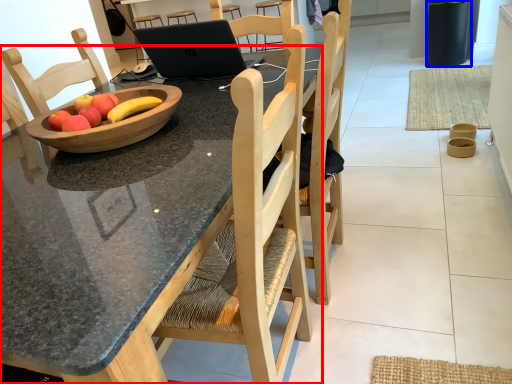
Question: Among these objects, which one is farthest to the camera, desk (highlighted by a red box) or trash bin/can (highlighted by a blue box)?

Choices:
 (A) desk
 (B) trash bin/can

Answer: (B)